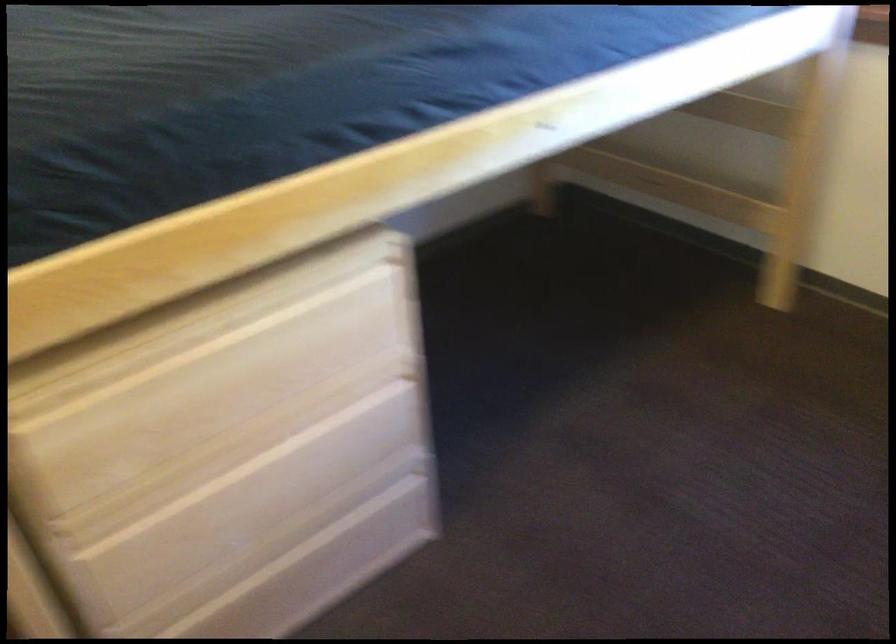
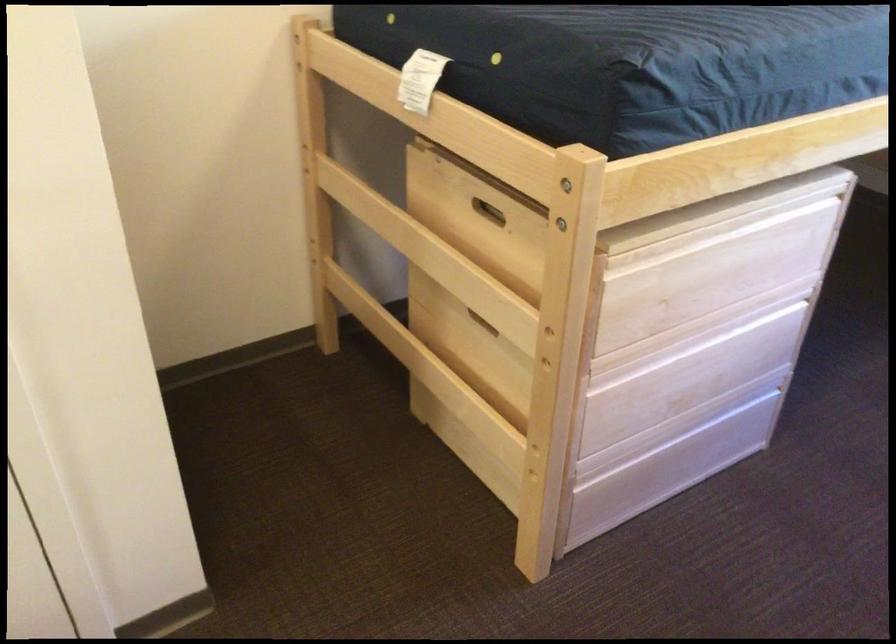
Locate, in the second image, the point that corresponds to point (214, 327) in the first image.

(720, 230)